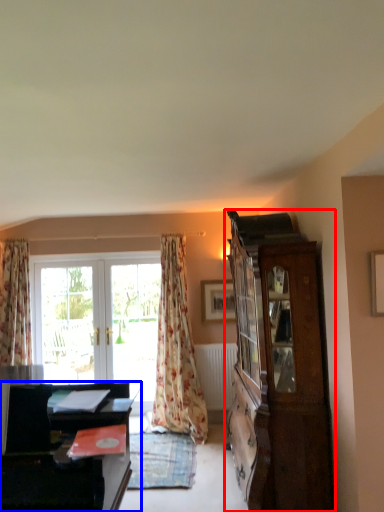
Question: Which of the following is the closest to the observer, cabinetry (highlighted by a red box) or desk (highlighted by a blue box)?

Choices:
 (A) cabinetry
 (B) desk

Answer: (B)